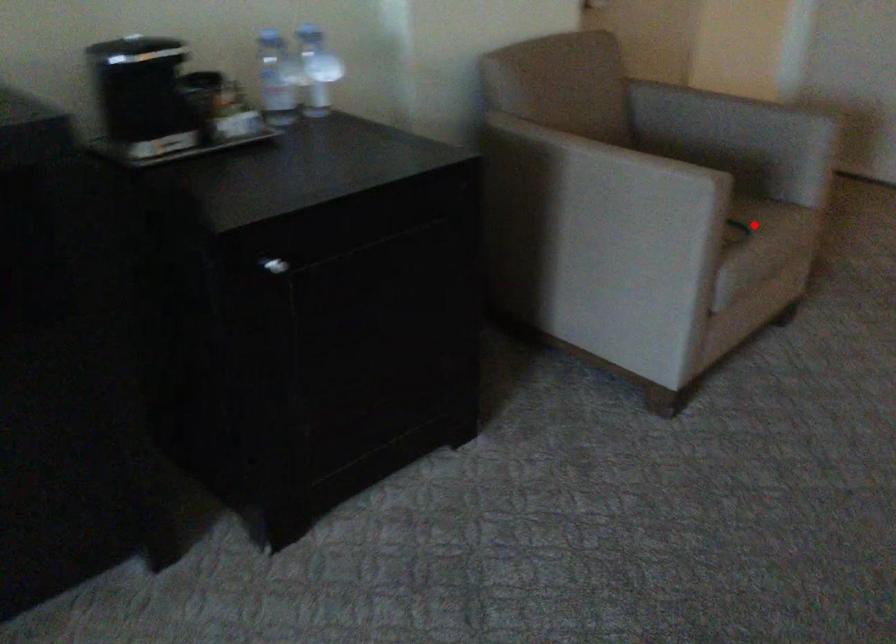
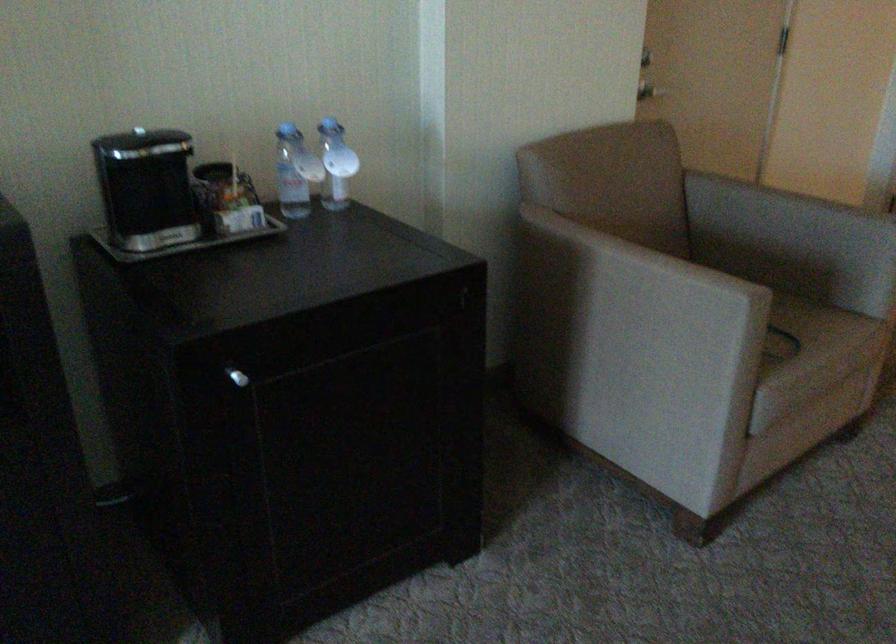
Question: I am providing you with two images of the same scene from different viewpoints. Image1 has a red point marked. In image2, the corresponding 3D location appears at what relative position? Reply with the corresponding letter.

Choices:
 (A) Closer
 (B) Farther

Answer: (A)